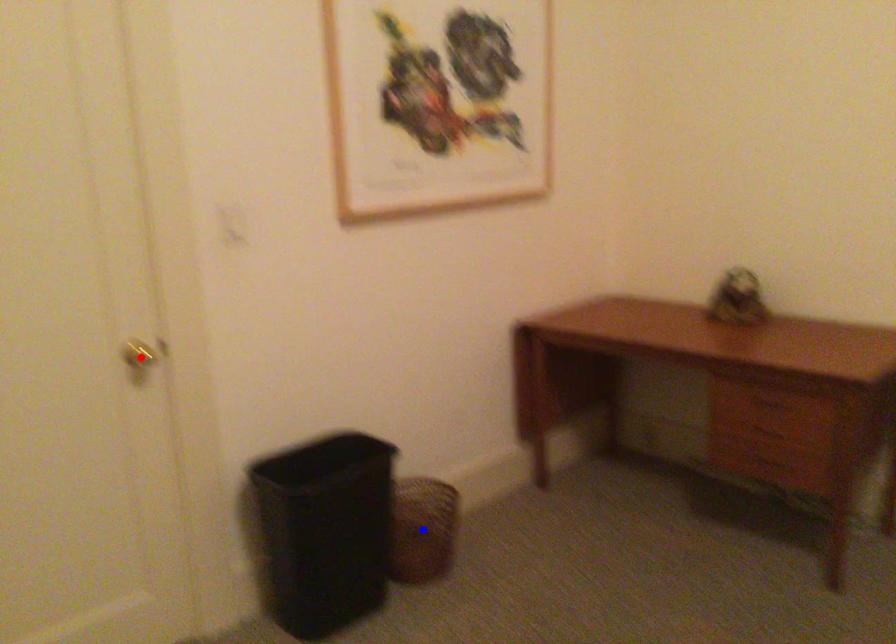
Question: Which of the two points in the image is closer to the camera?

Choices:
 (A) Blue point is closer.
 (B) Red point is closer.

Answer: (B)